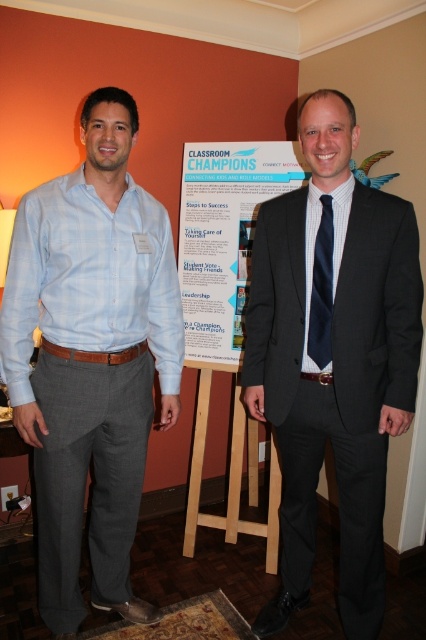
You are a photographer trying to capture a clear shot of both the white paper poster at center and the navy blue silk tie at center. Which object should you focus on first to ensure both are in focus?

You should focus on the navy blue silk tie at center first because it is closer to you than the white paper poster at center, which is further away. By focusing on the closer object, the poster will also be in focus due to the depth of field.

You are a photographer who needs to capture both the white paper poster at center and the navy blue silk tie at center in a single frame. Which object should you focus on first to ensure both are fully visible in the photo?

The white paper poster at center is wider than the navy blue silk tie at center, so you should focus on the white paper poster at center first to ensure both are fully visible in the photo.